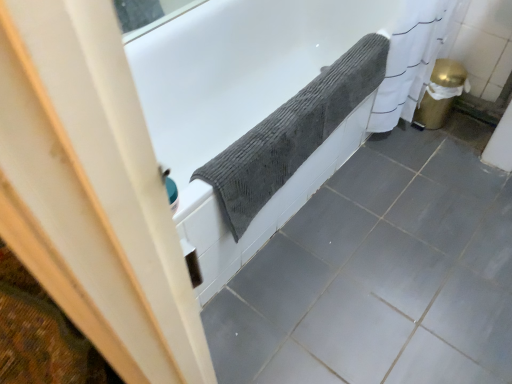
Question: Relative to gray textured towel at upper center, is textured gray towel at upper center, the 1th ceramic tile ordered from the bottom, in front or behind?

Choices:
 (A) front
 (B) behind

Answer: (A)

Question: From the image's perspective, relative to gray textured towel at upper center, is textured gray towel at upper center, the 1th ceramic tile ordered from the bottom, above or below?

Choices:
 (A) above
 (B) below

Answer: (B)

Question: Estimate the real-world distances between objects in this image. Which object is farther from the gray textured towel at upper center?

Choices:
 (A) gray textured towel at upper center
 (B) textured gray towel at upper center, positioned as the second ceramic tile in top-to-bottom order
 (C) gray matte ceramic tile at lower center, which is the 2th ceramic tile in bottom-to-top order

Answer: (C)

Question: Estimate the real-world distances between objects in this image. Which object is closer to the gray textured towel at upper center?

Choices:
 (A) textured gray towel at upper center, positioned as the second ceramic tile in top-to-bottom order
 (B) gray textured towel at upper center
 (C) gray matte ceramic tile at lower center, positioned as the 1th ceramic tile in top-to-bottom order

Answer: (B)